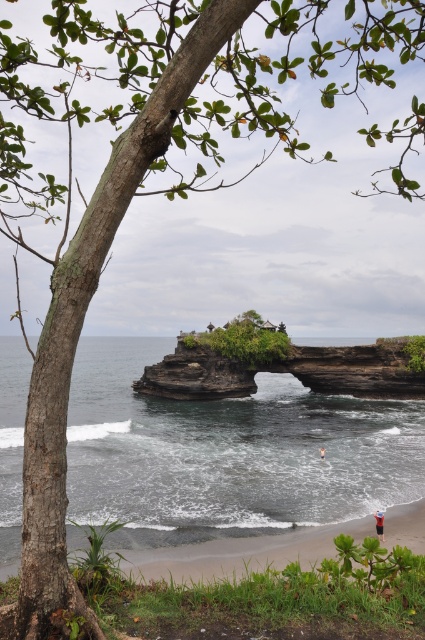
Does point (209, 513) come farther from viewer compared to point (175, 356)?

No, it is not.

Can you confirm if dark gray water at center is wider than dark brown stone arch at center?

Indeed, dark gray water at center has a greater width compared to dark brown stone arch at center.

Locate an element on the screen. dark gray water at center is located at coordinates (227, 456).